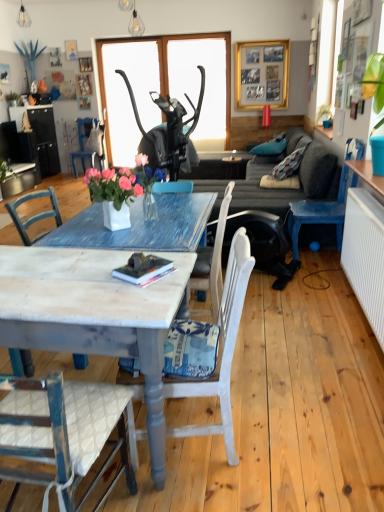
Question: Can you confirm if white painted wood chair at lower center, the 2th chair from the left, is bigger than hardcover book at center?

Choices:
 (A) no
 (B) yes

Answer: (B)

Question: Is white painted wood chair at lower center, the 2th chair from the left, wider than hardcover book at center?

Choices:
 (A) no
 (B) yes

Answer: (B)

Question: Is white painted wood chair at lower center, the 2th chair from the left, next to hardcover book at center and touching it?

Choices:
 (A) no
 (B) yes

Answer: (A)

Question: Considering the relative positions of white painted wood chair at lower center, which is the 1th chair from front to back, and hardcover book at center in the image provided, is white painted wood chair at lower center, which is the 1th chair from front to back, in front of hardcover book at center?

Choices:
 (A) yes
 (B) no

Answer: (A)

Question: From a real-world perspective, is white painted wood chair at lower center, which is the third chair in back-to-front order, on top of hardcover book at center?

Choices:
 (A) yes
 (B) no

Answer: (B)

Question: Is the depth of white painted wood chair at lower center, the first chair positioned from the bottom, greater than that of hardcover book at center?

Choices:
 (A) yes
 (B) no

Answer: (B)

Question: Can hardcover book at center be found inside metallic wire bulb at upper center, which is counted as the 2th lamp, starting from the bottom?

Choices:
 (A) yes
 (B) no

Answer: (B)

Question: Is metallic wire bulb at upper center, which is the first lamp from top to bottom, taller than hardcover book at center?

Choices:
 (A) no
 (B) yes

Answer: (B)

Question: Is the surface of metallic wire bulb at upper center, the first lamp positioned from the left, in direct contact with hardcover book at center?

Choices:
 (A) no
 (B) yes

Answer: (A)

Question: Is metallic wire bulb at upper center, which is the first lamp from top to bottom, looking in the opposite direction of hardcover book at center?

Choices:
 (A) yes
 (B) no

Answer: (B)

Question: From a real-world perspective, is metallic wire bulb at upper center, which is counted as the 2th lamp, starting from the bottom, located beneath hardcover book at center?

Choices:
 (A) no
 (B) yes

Answer: (A)

Question: Considering the relative sizes of metallic wire bulb at upper center, the first lamp positioned from the left, and hardcover book at center in the image provided, is metallic wire bulb at upper center, the first lamp positioned from the left, wider than hardcover book at center?

Choices:
 (A) yes
 (B) no

Answer: (B)

Question: Can you confirm if metallic pendant light at upper center, marked as the first lamp in a right-to-left arrangement, is shorter than blue painted wood chair at left, which appears as the third chair when viewed from the right?

Choices:
 (A) yes
 (B) no

Answer: (A)